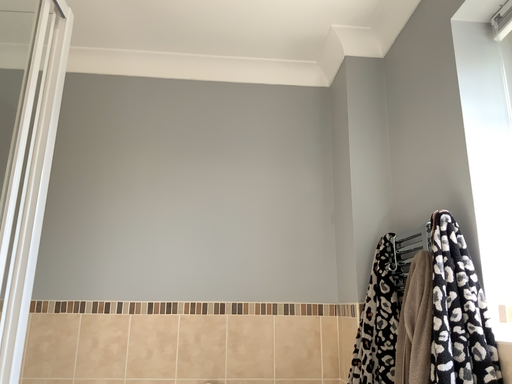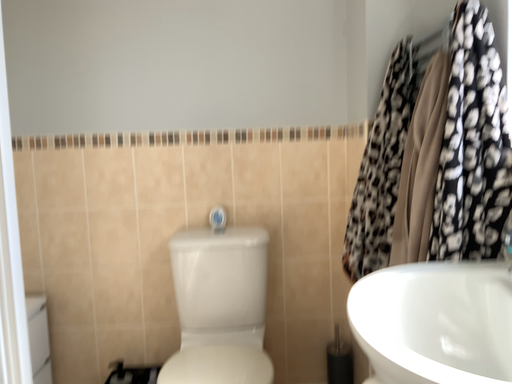
Question: Which way did the camera rotate in the video?

Choices:
 (A) rotated upward
 (B) rotated downward

Answer: (B)